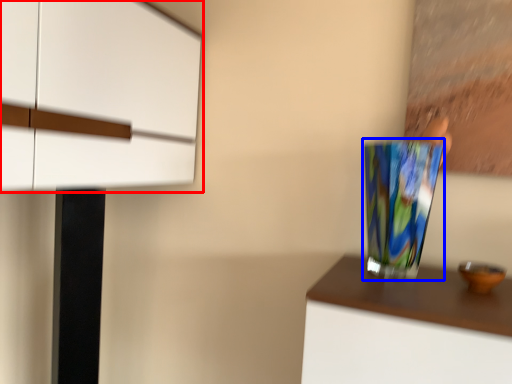
Question: Which of the following is the closest to the observer, cabinetry (highlighted by a red box) or vase (highlighted by a blue box)?

Choices:
 (A) cabinetry
 (B) vase

Answer: (A)